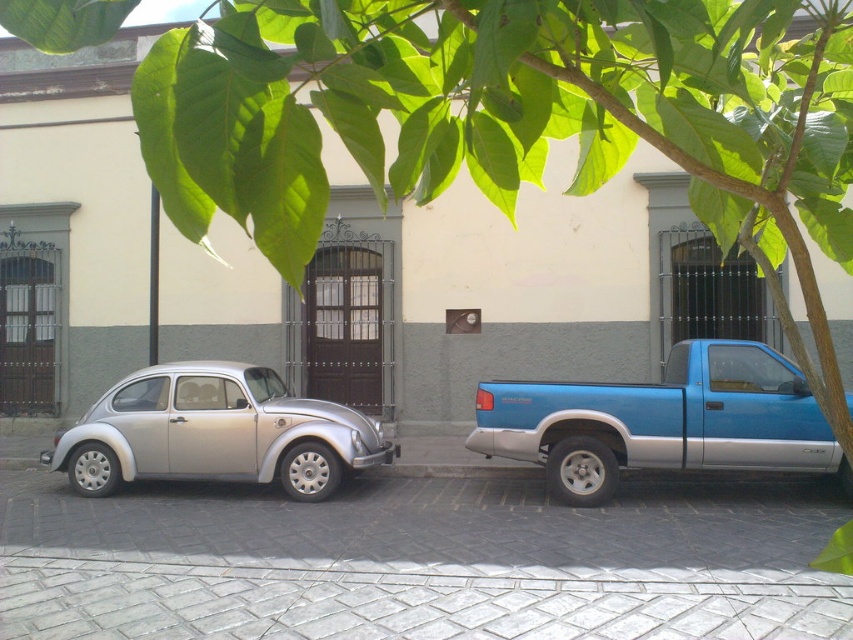
You are a delivery person trying to park your van between the blue metallic pickup truck at right and the silver metallic car at left. Can you fit your van, which is 5 meters long, in the space between them?

The blue metallic pickup truck at right is bigger than the silver metallic car at left, but the description does not provide the exact distance between them. Without knowing the space between the two vehicles, it is impossible to determine if the van can fit.

You are a delivery person trying to park a new vehicle between the blue metallic pickup truck at right and the silver metallic car at left. Can you fit a delivery van that is 2 meters wide in the space between them?

The blue metallic pickup truck at right is narrower than the silver metallic car at left. However, without knowing the exact distance between them, it is impossible to determine if the 2 meter wide delivery van can fit.

You are standing at the point marked by the coordinate point at point [662,420]. Looking towards the silver Volkswagen Beetle in the foreground, which direction should you walk to reach it?

The silver Volkswagen Beetle is to your left. You should walk to your left to reach it.